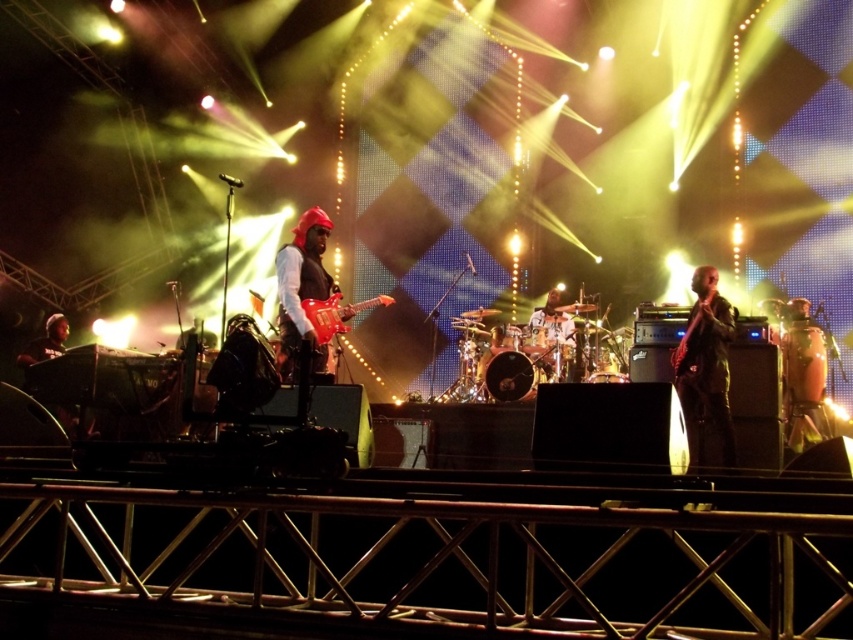
What do you see at coordinates (706, 360) in the screenshot? I see `black leather jacket at right` at bounding box center [706, 360].

Locate an element on the screen. This screenshot has height=640, width=853. black leather jacket at right is located at coordinates (706, 360).

How far apart are black leather jacket at right and glossy electric guitar at center?

black leather jacket at right is 2.40 meters away from glossy electric guitar at center.

Does black leather jacket at right appear under glossy electric guitar at center?

Yes, black leather jacket at right is below glossy electric guitar at center.

Which is behind, point (717, 321) or point (310, 308)?

The point (717, 321) is more distant.

The height and width of the screenshot is (640, 853). In order to click on black leather jacket at right in this screenshot , I will do `click(706, 360)`.

Does shiny silver drum set at center appear under glossy electric guitar at center?

Correct, shiny silver drum set at center is located below glossy electric guitar at center.

The height and width of the screenshot is (640, 853). I want to click on shiny silver drum set at center, so click(556, 330).